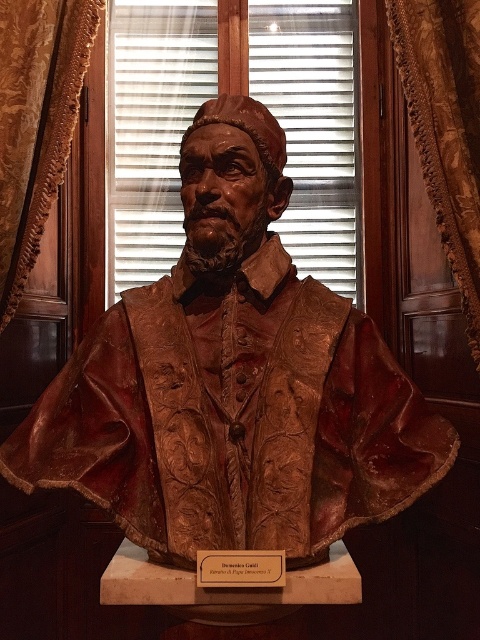
Question: Which point is farther from the camera taking this photo?

Choices:
 (A) (36, 179)
 (B) (249, 552)
 (C) (146, 227)
 (D) (427, 483)

Answer: (C)

Question: From the image, what is the correct spatial relationship of brown textured curtain at left in relation to matte gold plaque at center?

Choices:
 (A) left
 (B) right

Answer: (A)

Question: Can you confirm if bronze statue at center is positioned to the left of brown textured curtain at left?

Choices:
 (A) yes
 (B) no

Answer: (B)

Question: Among these points, which one is farthest from the camera?

Choices:
 (A) (407, 484)
 (B) (82, 38)
 (C) (312, 195)
 (D) (443, 168)

Answer: (C)

Question: Does brown textured curtain at left have a lesser width compared to velvet drapery at right?

Choices:
 (A) yes
 (B) no

Answer: (B)

Question: Which of the following is the farthest from the observer?

Choices:
 (A) (303, 72)
 (B) (78, 424)

Answer: (A)